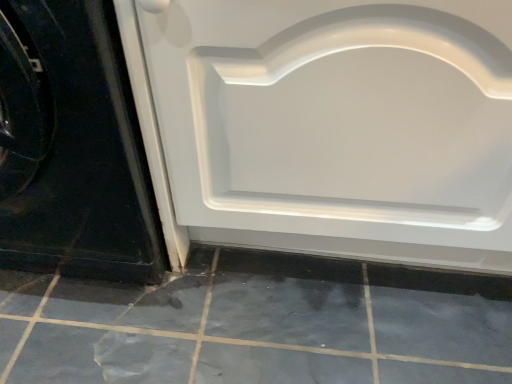
Question: Does gray matte tile at lower center have a greater width compared to white glossy door at center, which appears as the 2th door when viewed from the left?

Choices:
 (A) no
 (B) yes

Answer: (B)

Question: Is gray matte tile at lower center next to white glossy door at center, marked as the first door in a right-to-left arrangement, and touching it?

Choices:
 (A) no
 (B) yes

Answer: (A)

Question: Does gray matte tile at lower center have a greater height compared to white glossy door at center, which appears as the 2th door when viewed from the left?

Choices:
 (A) no
 (B) yes

Answer: (A)

Question: Is white glossy door at center, marked as the first door in a right-to-left arrangement, completely or partially inside gray matte tile at lower center?

Choices:
 (A) no
 (B) yes

Answer: (A)

Question: Would you consider gray matte tile at lower center to be distant from white glossy door at center, which appears as the 2th door when viewed from the left?

Choices:
 (A) yes
 (B) no

Answer: (B)

Question: In terms of width, does white glossy door at lower left, which appears as the second door when viewed from the right, look wider or thinner when compared to white glossy door at center, marked as the first door in a right-to-left arrangement?

Choices:
 (A) thin
 (B) wide

Answer: (B)

Question: In terms of size, does white glossy door at lower left, which appears as the second door when viewed from the right, appear bigger or smaller than white glossy door at center, which appears as the 2th door when viewed from the left?

Choices:
 (A) small
 (B) big

Answer: (A)

Question: In the image, is white glossy door at lower left, which appears as the second door when viewed from the right, on the left side or the right side of white glossy door at center, marked as the first door in a right-to-left arrangement?

Choices:
 (A) left
 (B) right

Answer: (A)

Question: From the image's perspective, is white glossy door at lower left, which is the first door from left to right, above or below white glossy door at center, which appears as the 2th door when viewed from the left?

Choices:
 (A) above
 (B) below

Answer: (A)

Question: From the image's perspective, is white glossy door at lower left, which is the first door from left to right, positioned above or below gray matte tile at lower center?

Choices:
 (A) above
 (B) below

Answer: (A)

Question: From a real-world perspective, is white glossy door at lower left, which is the first door from left to right, positioned above or below gray matte tile at lower center?

Choices:
 (A) below
 (B) above

Answer: (B)

Question: Is point (24, 203) positioned closer to the camera than point (51, 365)?

Choices:
 (A) farther
 (B) closer

Answer: (A)

Question: Looking at the image, does white glossy door at lower left, which is the first door from left to right, seem bigger or smaller compared to gray matte tile at lower center?

Choices:
 (A) small
 (B) big

Answer: (B)

Question: In terms of size, does gray matte tile at lower center appear bigger or smaller than white glossy door at center, which appears as the 2th door when viewed from the left?

Choices:
 (A) big
 (B) small

Answer: (B)

Question: In terms of height, does gray matte tile at lower center look taller or shorter compared to white glossy door at center, which appears as the 2th door when viewed from the left?

Choices:
 (A) tall
 (B) short

Answer: (B)